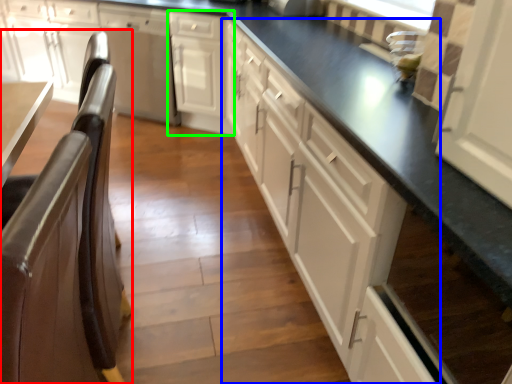
Question: Estimate the real-world distances between objects in this image. Which object is closer to chair (highlighted by a red box), cabinetry (highlighted by a blue box) or cabinetry (highlighted by a green box)?

Choices:
 (A) cabinetry
 (B) cabinetry

Answer: (A)